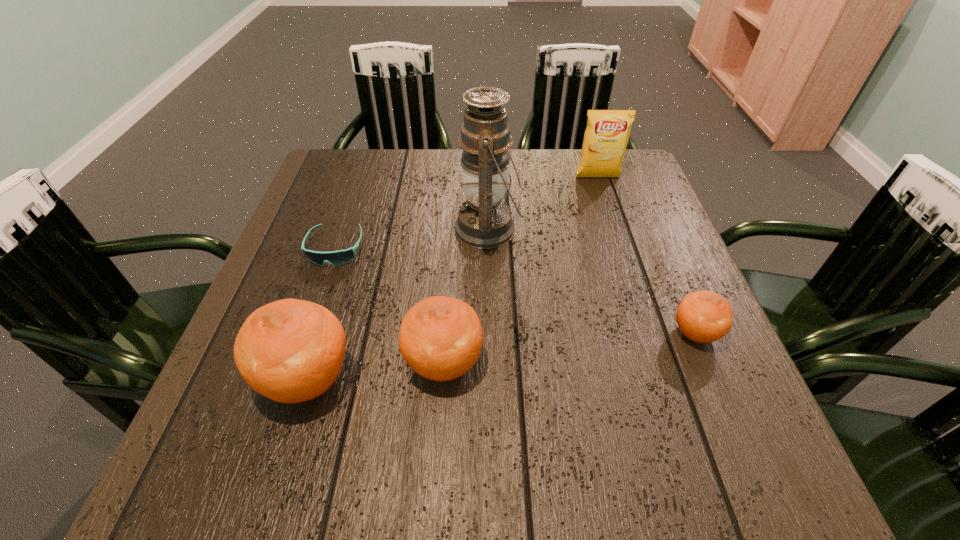
Where is `object that is positioned at the far right corner`? This screenshot has height=540, width=960. object that is positioned at the far right corner is located at coordinates (606, 136).

In the image, there is a desktop. Identify the location of vacant area at the far edge. This screenshot has width=960, height=540. (525, 173).

You are a GUI agent. You are given a task and a screenshot of the screen. Output one action in this format:
    pyautogui.click(x=<x>, y=<y>)
    Task: Click on the free space at the near edge of the desktop
    
    Given the screenshot: What is the action you would take?
    click(324, 422)

Locate an element on the screen. Image resolution: width=960 pixels, height=540 pixels. vacant region at the right edge of the desktop is located at coordinates (668, 249).

Identify the location of free spot at the far left corner of the desktop. The image size is (960, 540). (338, 150).

The image size is (960, 540). I want to click on free space at the near right corner, so click(701, 389).

Locate an element on the screen. free space between the leftmost orange and the third shortest object is located at coordinates (375, 371).

Locate an element on the screen. This screenshot has height=540, width=960. vacant region between the rightmost orange and the leftmost orange is located at coordinates (501, 356).

The width and height of the screenshot is (960, 540). In order to click on free space that is in between the oil lamp and the second orange from right to left in this screenshot , I will do `click(467, 296)`.

Locate an element on the screen. The width and height of the screenshot is (960, 540). empty location between the farthest object and the fourth tallest object is located at coordinates (520, 270).